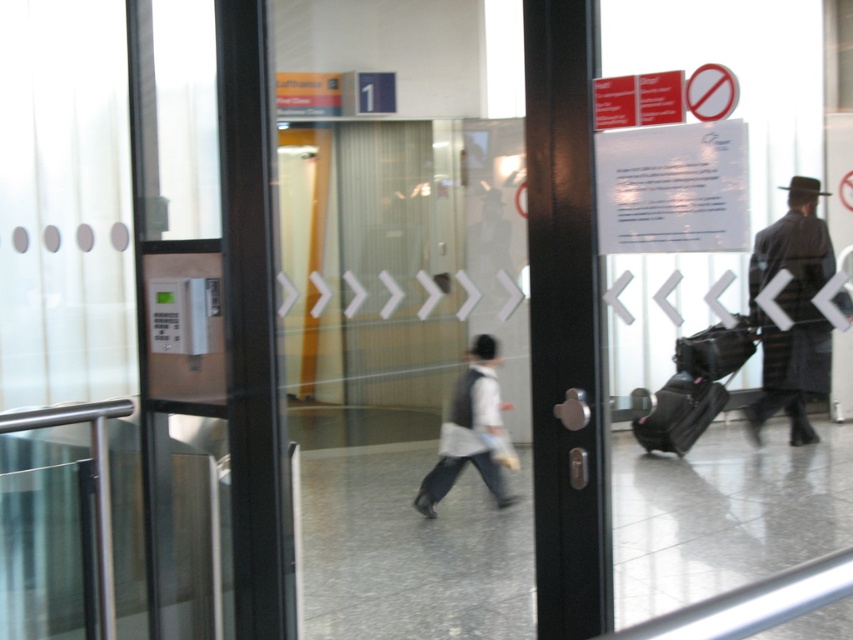
Question: Which point is closer to the camera taking this photo?

Choices:
 (A) coord(793,248)
 (B) coord(682,346)
 (C) coord(677,449)
 (D) coord(665,442)

Answer: (A)

Question: Which of the following is the closest to the observer?

Choices:
 (A) (670, 436)
 (B) (473, 410)

Answer: (A)

Question: Can you confirm if dark wool coat at right is positioned above black fabric suitcase at right?

Choices:
 (A) yes
 (B) no

Answer: (A)

Question: Does white fabric shirt at center lie in front of black fabric suitcase at lower right?

Choices:
 (A) no
 (B) yes

Answer: (A)

Question: Among these points, which one is farthest from the camera?

Choices:
 (A) (697, 433)
 (B) (675, 451)

Answer: (B)

Question: Does white fabric shirt at center appear over black fabric suitcase at lower right?

Choices:
 (A) yes
 (B) no

Answer: (B)